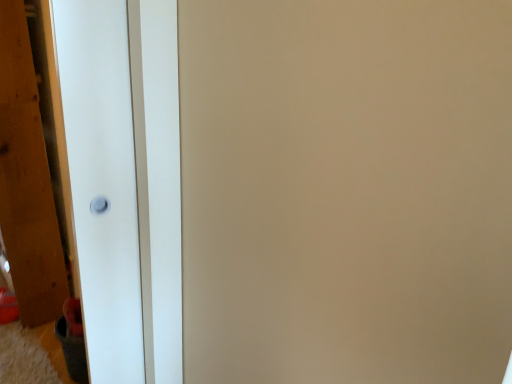
Describe the element at coordinates (102, 181) in the screenshot. I see `white glossy door at left` at that location.

I want to click on white glossy door at left, so click(x=102, y=181).

Where is `white glossy door at left`? This screenshot has width=512, height=384. white glossy door at left is located at coordinates (102, 181).